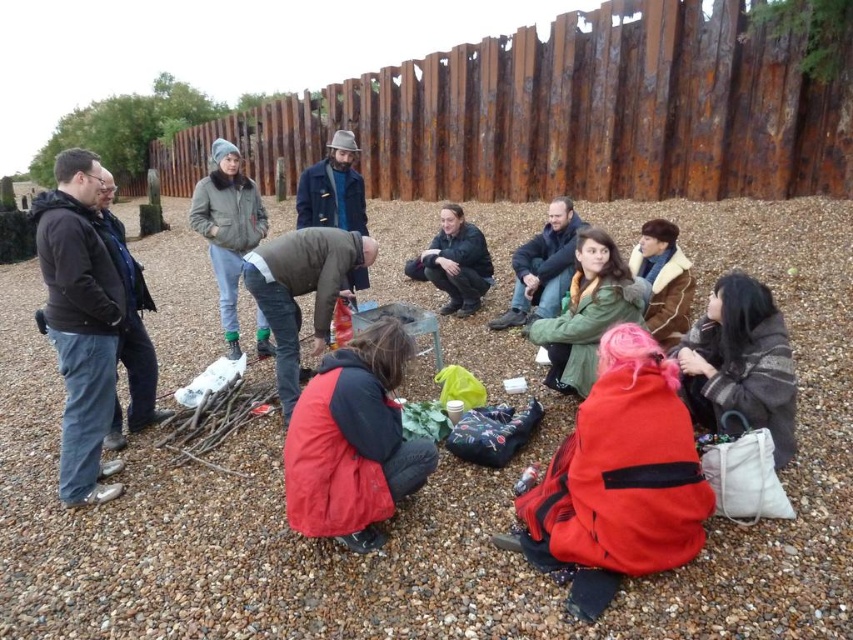
Question: Can you confirm if red matte jacket at lower center is wider than green matte jacket at center?

Choices:
 (A) no
 (B) yes

Answer: (A)

Question: Which point is closer to the camera taking this photo?

Choices:
 (A) (657, 244)
 (B) (572, 248)

Answer: (A)

Question: Considering the relative positions of brown gravel at center and black jacket at left in the image provided, where is brown gravel at center located with respect to black jacket at left?

Choices:
 (A) below
 (B) above

Answer: (B)

Question: Which point is closer to the camera?

Choices:
 (A) gray fuzzy jacket at center
 (B) green matte jacket at center

Answer: (B)

Question: Is rusty metal fence at upper center thinner than brown leather jacket at center?

Choices:
 (A) yes
 (B) no

Answer: (B)

Question: Estimate the real-world distances between objects in this image. Which object is farther from the brown fuzzy coat at lower right?

Choices:
 (A) brown leather jacket at center
 (B) dark blue jacket at center
 (C) gray fuzzy jacket at center
 (D) rustic wooden coat at center

Answer: (D)